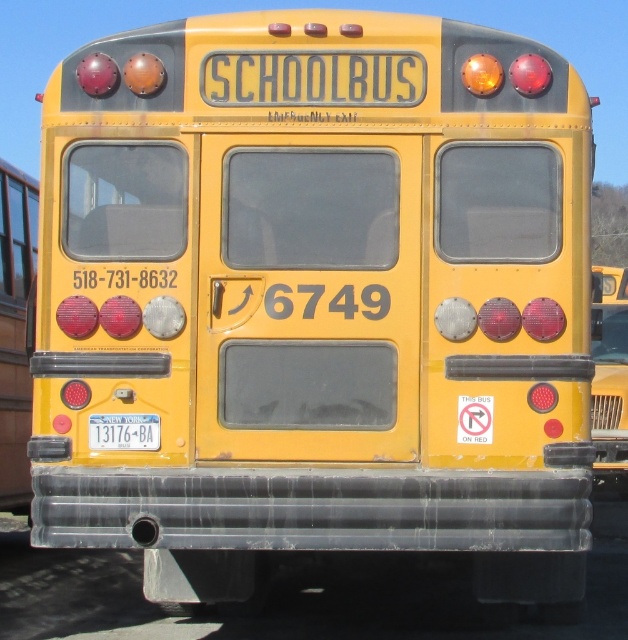
Which is below, transparent plastic pipe at lower center or yellow matte bus at right?

transparent plastic pipe at lower center

Is point (392, 589) more distant than point (605, 328)?

No, (392, 589) is in front of (605, 328).

Locate an element on the screen. transparent plastic pipe at lower center is located at coordinates (295, 596).

Who is positioned more to the right, yellow matte bus at right or white plastic license plate at center?

yellow matte bus at right

Is yellow matte bus at right shorter than white plastic license plate at center?

No, yellow matte bus at right is not shorter than white plastic license plate at center.

At what (x,y) coordinates should I click in order to perform the action: click on yellow matte bus at right. Please return your answer as a coordinate pair (x, y). Looking at the image, I should click on (609, 374).

Does transparent plastic pipe at lower center have a greater height compared to white plastic license plate at center?

No.

Who is higher up, transparent plastic pipe at lower center or white plastic license plate at center?

white plastic license plate at center is above.

The width and height of the screenshot is (628, 640). What are the coordinates of `transparent plastic pipe at lower center` in the screenshot? It's located at (295, 596).